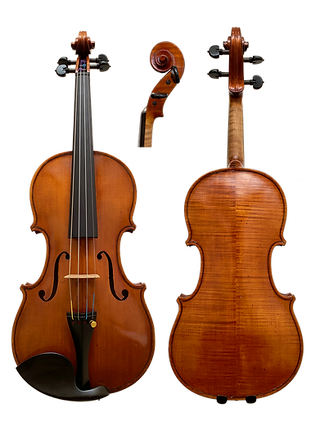
Identify the location of knob. (215, 49).